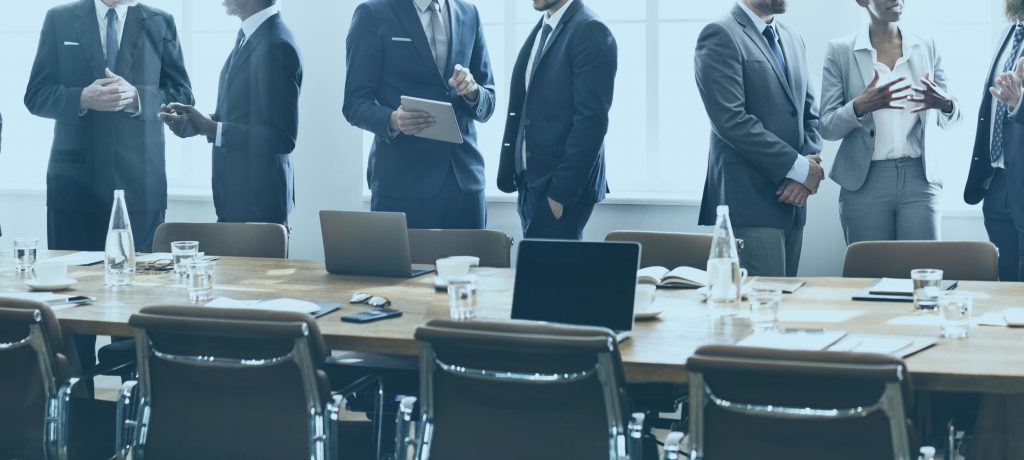
Where is `chairs`? The image size is (1024, 460). chairs is located at coordinates (195, 400), (25, 374), (236, 241), (456, 234), (668, 242), (889, 253), (794, 378), (502, 372).